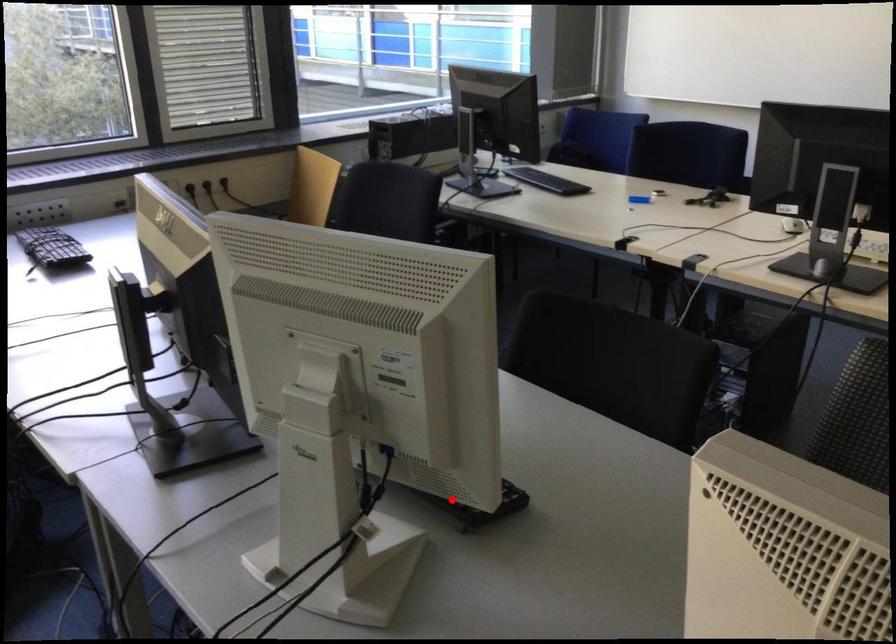
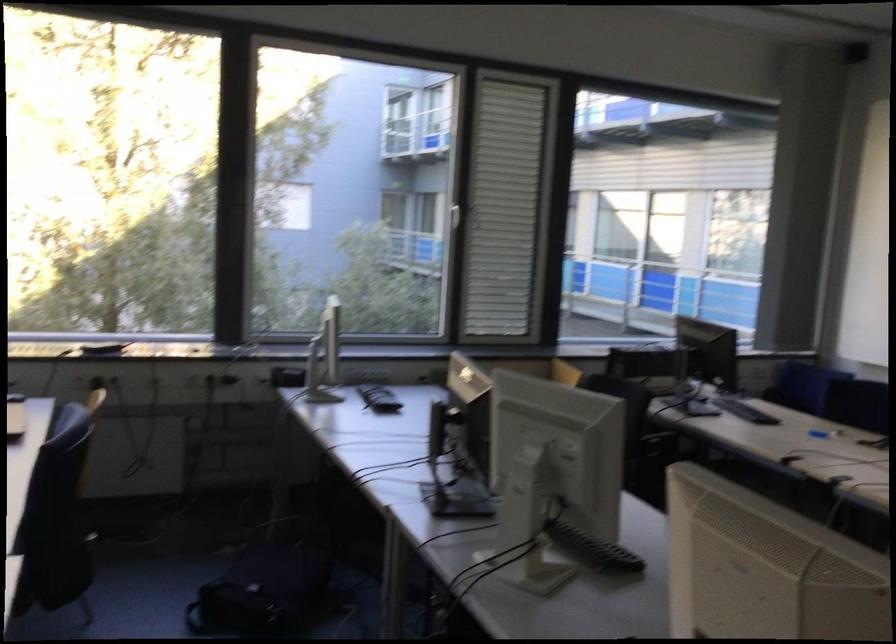
Question: I am providing you with two images of the same scene from different viewpoints. A red point is shown in image1. For the corresponding object point in image2, is it positioned nearer or farther from the camera?

Choices:
 (A) Nearer
 (B) Farther

Answer: (B)